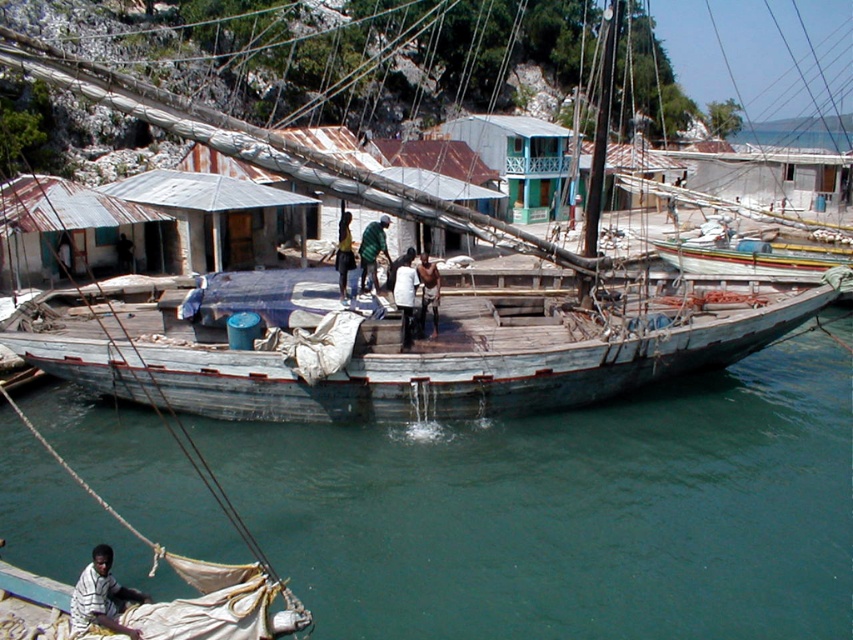
Question: Does blue wooden boat at center lie in front of striped fabric shirt at lower left?

Choices:
 (A) no
 (B) yes

Answer: (A)

Question: Which object appears closest to the camera in this image?

Choices:
 (A) dark green fabric at center
 (B) green fabric shirt at center
 (C) weathered wood boat at center
 (D) striped fabric shirt at lower left

Answer: (D)

Question: Which of the following is the closest to the observer?

Choices:
 (A) (74, 624)
 (B) (370, 275)

Answer: (A)

Question: Can you confirm if weathered wood boat at center is bigger than dark brown leather jacket at center?

Choices:
 (A) no
 (B) yes

Answer: (B)

Question: From the image, what is the correct spatial relationship of white matte shirt at center in relation to dark brown leather jacket at center?

Choices:
 (A) below
 (B) above

Answer: (A)

Question: Which object is positioned farthest from the dark green fabric at center?

Choices:
 (A) blue wooden boat at center
 (B) dark brown leather jacket at center
 (C) green fabric shirt at center

Answer: (A)